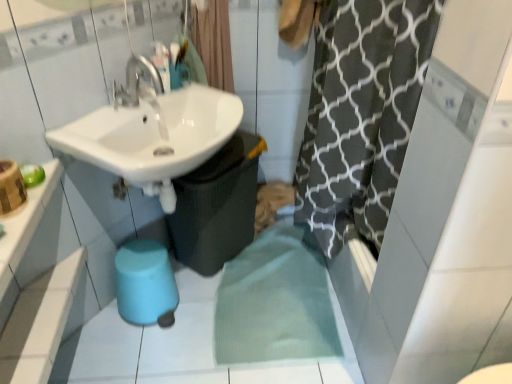
Question: Could you tell me if blue rubber bidet at lower center is facing white glossy counter top at upper left?

Choices:
 (A) no
 (B) yes

Answer: (A)

Question: Does blue rubber bidet at lower center have a greater height compared to white glossy counter top at upper left?

Choices:
 (A) no
 (B) yes

Answer: (B)

Question: Is blue rubber bidet at lower center located outside white glossy counter top at upper left?

Choices:
 (A) yes
 (B) no

Answer: (A)

Question: From a real-world perspective, is blue rubber bidet at lower center under white glossy counter top at upper left?

Choices:
 (A) no
 (B) yes

Answer: (B)

Question: Is blue rubber bidet at lower center thinner than white glossy counter top at upper left?

Choices:
 (A) no
 (B) yes

Answer: (A)

Question: Is white glossy counter top at upper left completely or partially inside blue rubber bidet at lower center?

Choices:
 (A) no
 (B) yes

Answer: (A)

Question: Is white glossy counter top at upper left not close to blue rubber bidet at lower center?

Choices:
 (A) yes
 (B) no

Answer: (B)

Question: Does white glossy counter top at upper left have a greater height compared to blue rubber bidet at lower center?

Choices:
 (A) yes
 (B) no

Answer: (B)

Question: Does white glossy counter top at upper left appear on the right side of blue rubber bidet at lower center?

Choices:
 (A) no
 (B) yes

Answer: (A)

Question: Is white glossy counter top at upper left further to the viewer compared to blue rubber bidet at lower center?

Choices:
 (A) no
 (B) yes

Answer: (A)

Question: From a real-world perspective, is white glossy counter top at upper left on top of blue rubber bidet at lower center?

Choices:
 (A) no
 (B) yes

Answer: (B)

Question: Considering the relative sizes of white glossy counter top at upper left and blue rubber bidet at lower center in the image provided, is white glossy counter top at upper left thinner than blue rubber bidet at lower center?

Choices:
 (A) no
 (B) yes

Answer: (B)

Question: Is black textured shower curtain at upper center far from white glossy counter top at upper left?

Choices:
 (A) no
 (B) yes

Answer: (A)